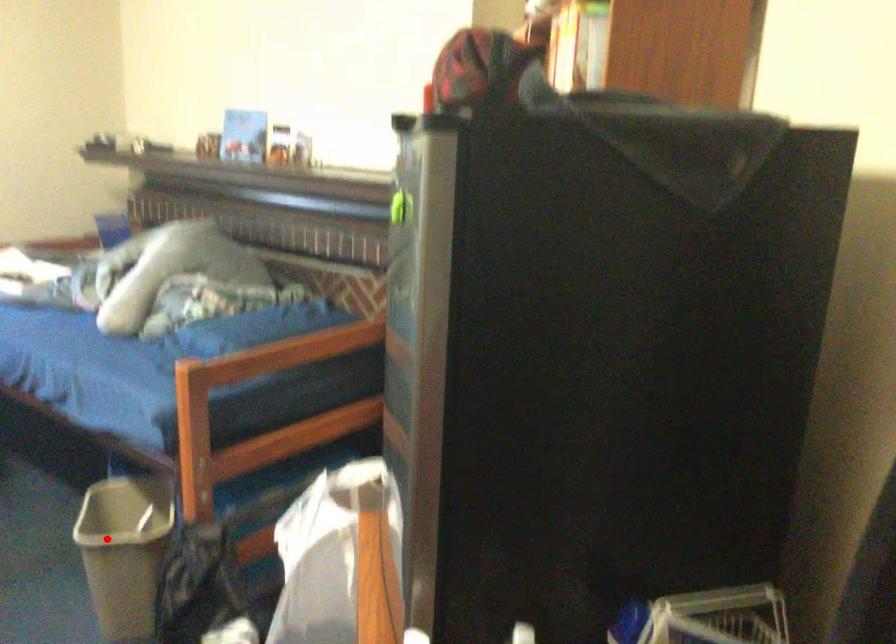
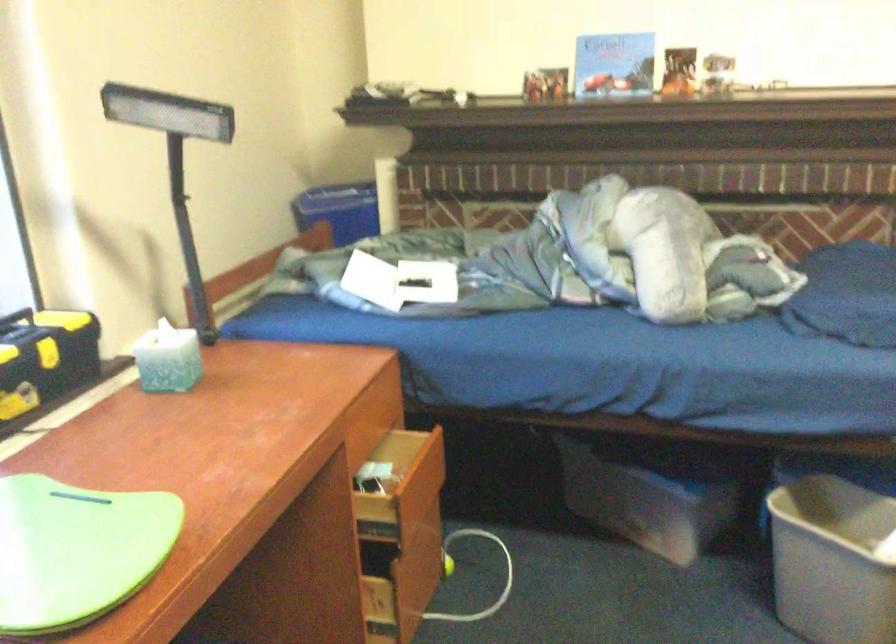
Find the pixel in the second image that matches the highlighted location in the first image.

(832, 561)